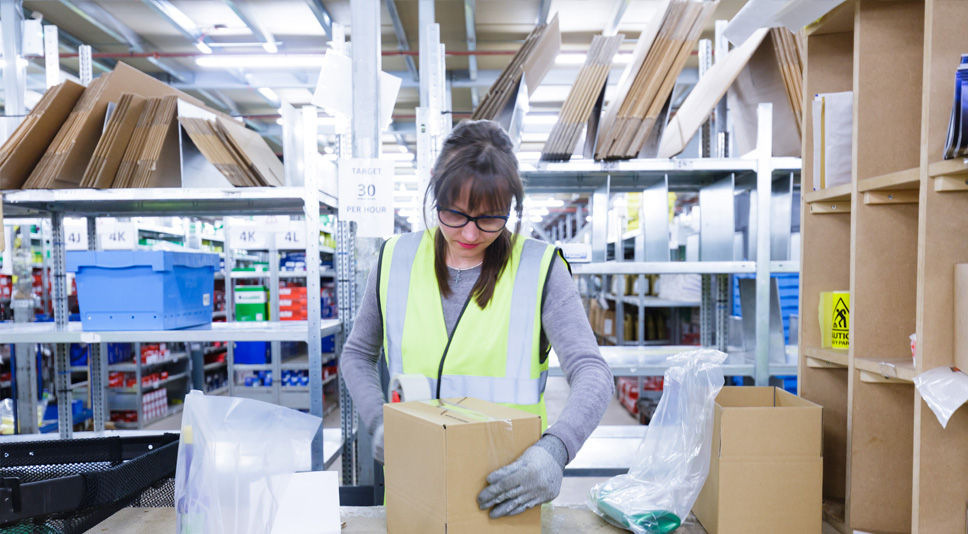
Find the location of a particular element. Image resolution: width=968 pixels, height=534 pixels. metal beam across ceiling is located at coordinates (116, 32), (76, 42), (170, 15), (242, 14), (317, 7), (402, 22), (468, 23), (546, 14), (616, 17).